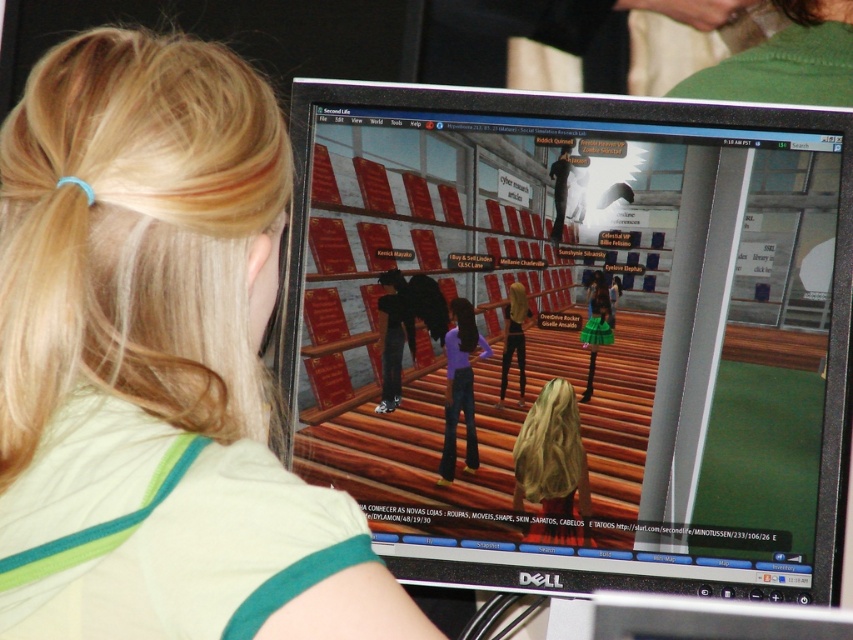
Question: Which object appears closest to the camera in this image?

Choices:
 (A) purple denim jeans at center
 (B) blonde hair at upper left
 (C) wooden floor at center

Answer: (B)

Question: Can you confirm if wooden floor at center is positioned below purple denim jeans at center?

Choices:
 (A) no
 (B) yes

Answer: (A)

Question: Which point is farther to the camera?

Choices:
 (A) (440, 545)
 (B) (465, 433)

Answer: (B)

Question: Is wooden floor at center bigger than blonde hair at upper left?

Choices:
 (A) yes
 (B) no

Answer: (B)

Question: Which of the following is the closest to the observer?

Choices:
 (A) purple denim jeans at center
 (B) wooden floor at center
 (C) blonde hair at upper left

Answer: (C)

Question: Is blonde hair at upper left positioned in front of purple denim jeans at center?

Choices:
 (A) no
 (B) yes

Answer: (B)